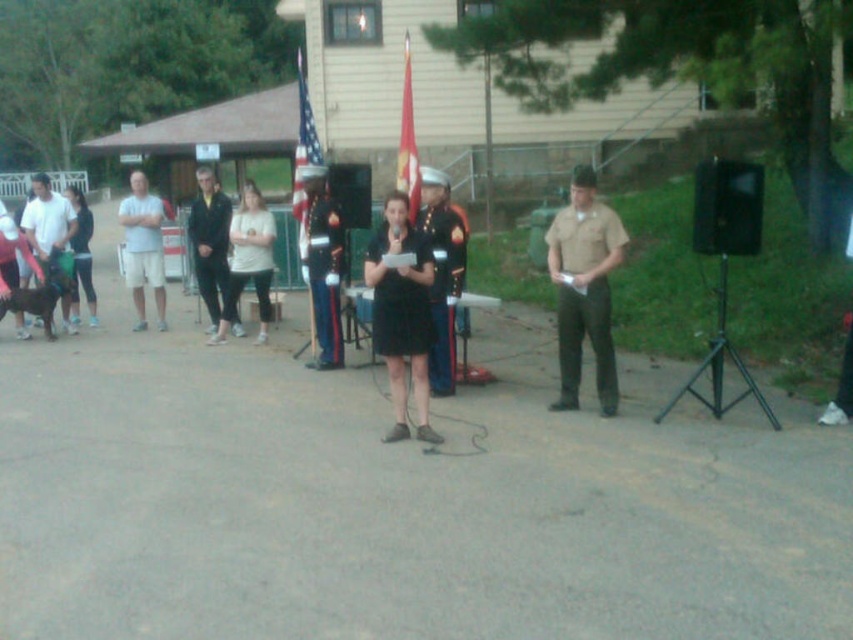
Between point (393, 312) and point (300, 90), which one is positioned behind?

The point (300, 90) is more distant.

Is point (389, 243) farther from camera compared to point (308, 179)?

No.

Between point (375, 268) and point (303, 124), which one is positioned behind?

Point (303, 124)

Where is `black matte dress at center`? This screenshot has width=853, height=640. black matte dress at center is located at coordinates (402, 314).

Based on the photo, does black plastic speaker at right have a greater height compared to light beige fabric shirt at center?

Yes, black plastic speaker at right is taller than light beige fabric shirt at center.

In the scene shown: Who is lower down, black plastic speaker at right or light beige fabric shirt at center?

light beige fabric shirt at center is lower down.

This screenshot has width=853, height=640. I want to click on black plastic speaker at right, so click(x=727, y=208).

Based on the photo, between khaki uniform at right and white cotton shorts at left, which one has more height?

With more height is white cotton shorts at left.

Does khaki uniform at right have a larger size compared to white cotton shorts at left?

Actually, khaki uniform at right might be smaller than white cotton shorts at left.

Which is behind, point (589, 280) or point (146, 200)?

Point (146, 200)

Where is `khaki uniform at right`? This screenshot has width=853, height=640. khaki uniform at right is located at coordinates (584, 289).